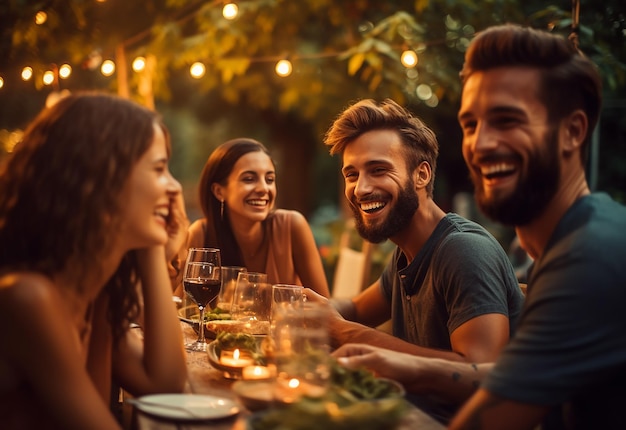
At what (x,y) coordinates should I click in order to perform the action: click on lightbulbs. Please return your answer as a coordinate pair (x, y). This screenshot has height=430, width=626. Looking at the image, I should click on (24, 71), (47, 78), (64, 73), (106, 65), (136, 60), (195, 67), (280, 67), (409, 57), (230, 13).